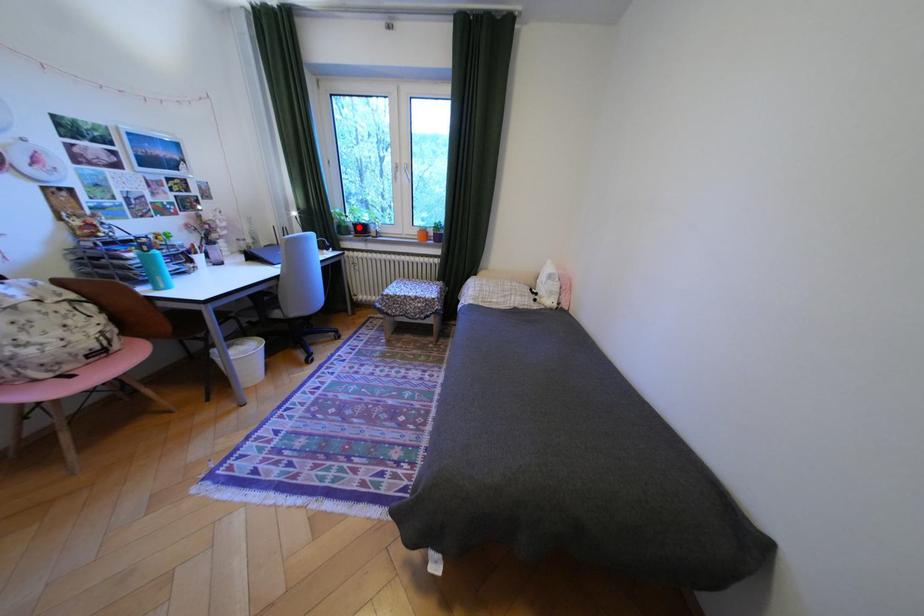
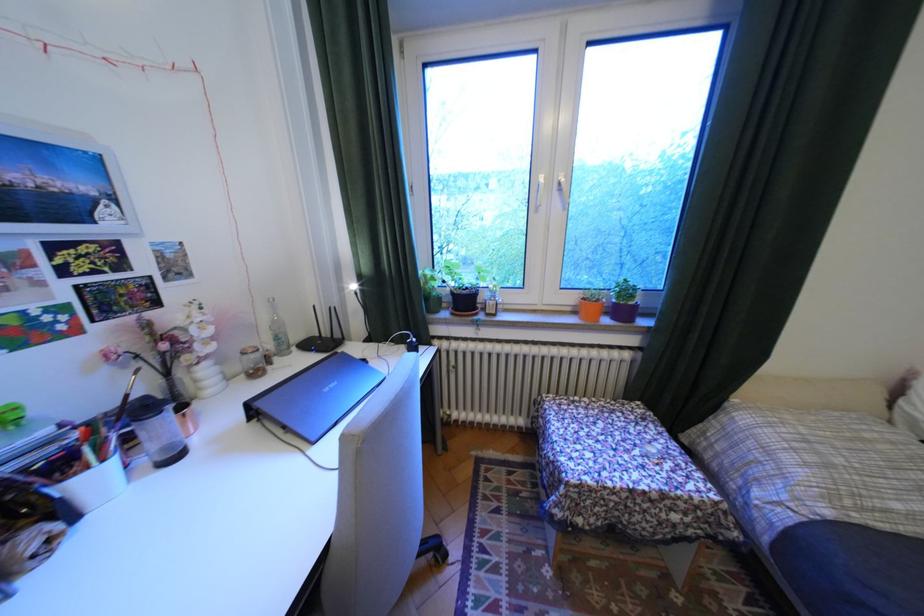
In the second image, find the point that corresponds to the highlighted location in the first image.

(451, 299)